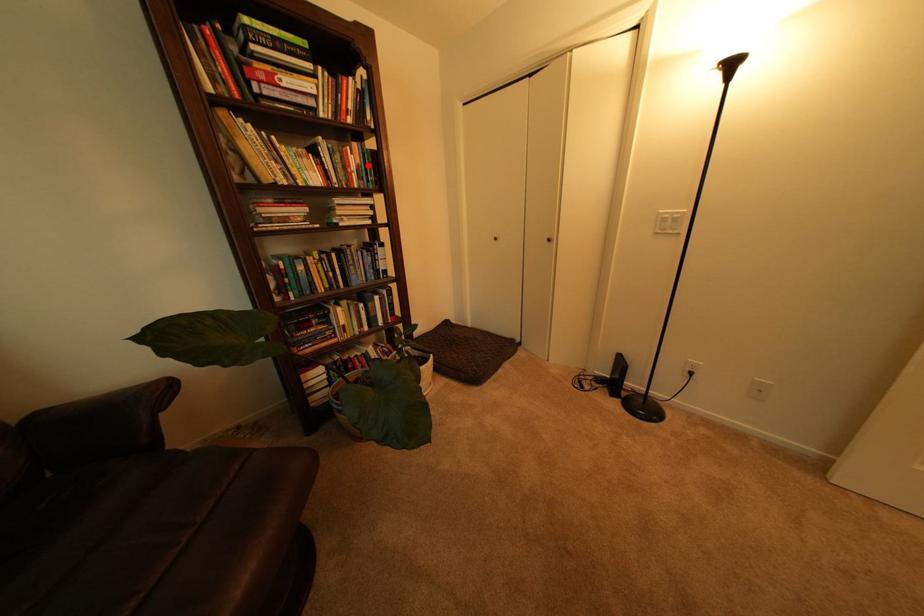
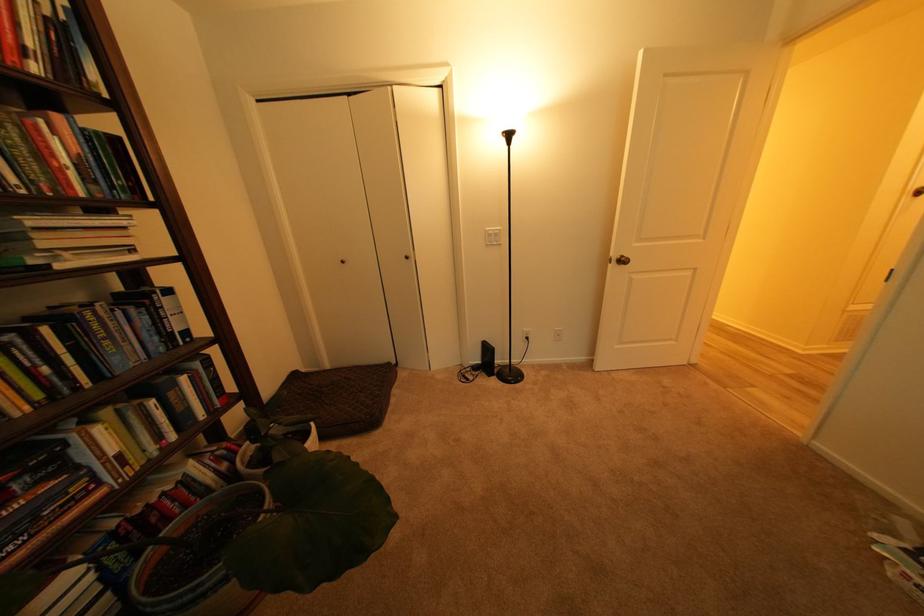
Where in the second image is the point corresponding to the highlighted location from the first image?

(84, 156)